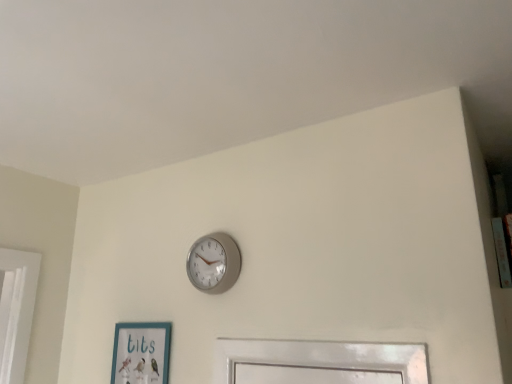
Question: Considering the positions of silver metallic clock at upper center and teal matte picture frame at lower left in the image, is silver metallic clock at upper center taller or shorter than teal matte picture frame at lower left?

Choices:
 (A) tall
 (B) short

Answer: (B)

Question: Is point (230, 284) closer or farther from the camera than point (115, 362)?

Choices:
 (A) closer
 (B) farther

Answer: (A)

Question: From the image's perspective, relative to teal matte picture frame at lower left, is silver metallic clock at upper center above or below?

Choices:
 (A) above
 (B) below

Answer: (A)

Question: Looking at the image, does teal matte picture frame at lower left seem bigger or smaller compared to silver metallic clock at upper center?

Choices:
 (A) small
 (B) big

Answer: (B)

Question: Is teal matte picture frame at lower left taller or shorter than silver metallic clock at upper center?

Choices:
 (A) tall
 (B) short

Answer: (A)

Question: Considering their positions, is teal matte picture frame at lower left located in front of or behind silver metallic clock at upper center?

Choices:
 (A) front
 (B) behind

Answer: (B)

Question: From the image's perspective, is teal matte picture frame at lower left above or below silver metallic clock at upper center?

Choices:
 (A) below
 (B) above

Answer: (A)